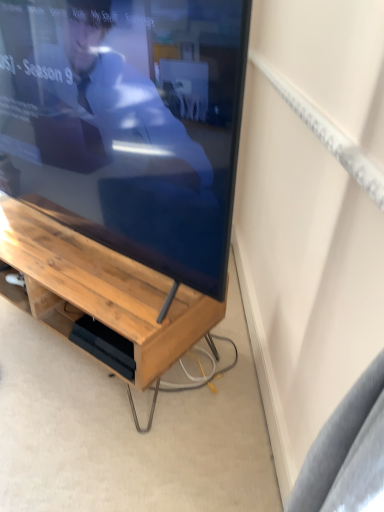
Find the location of `free spot in front of wooden desk at center`. free spot in front of wooden desk at center is located at coordinates (81, 435).